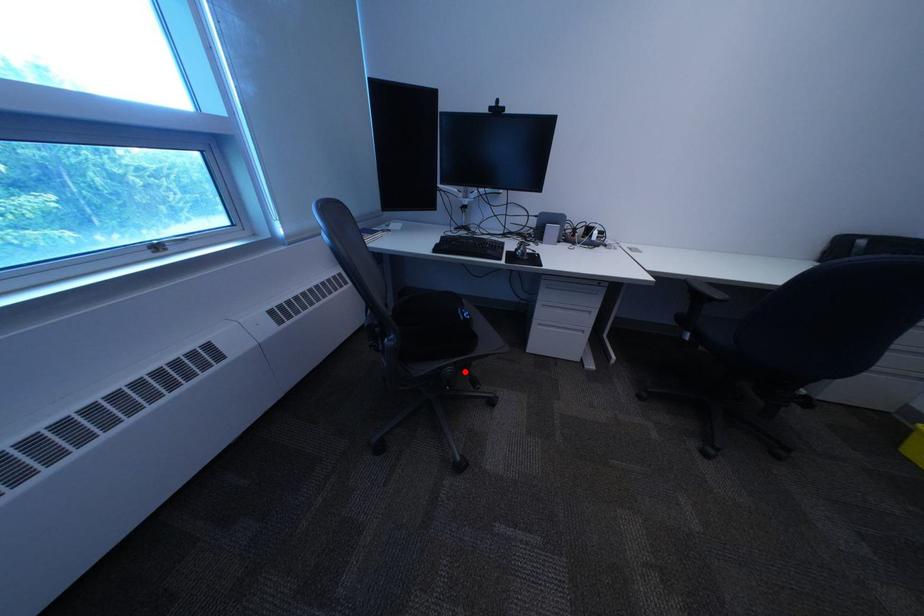
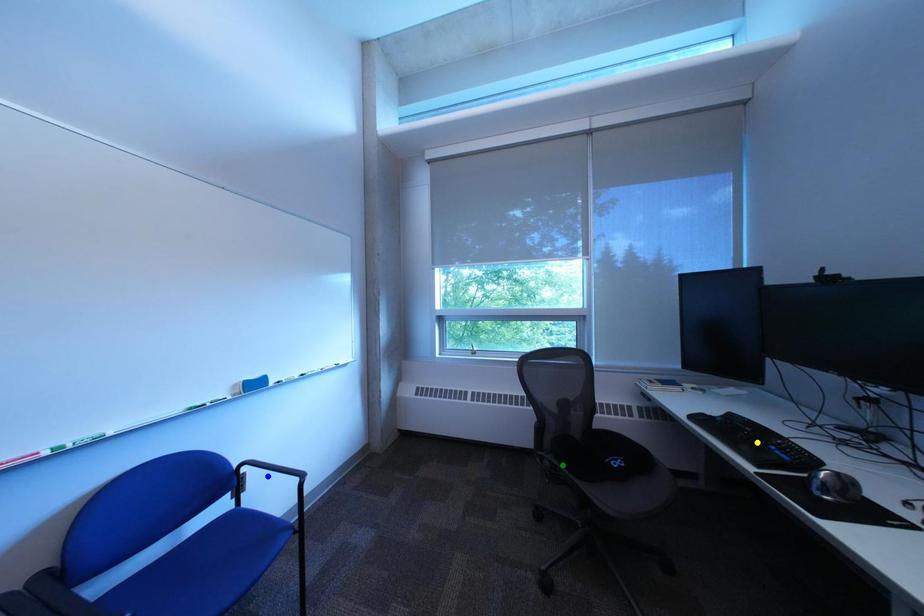
Question: I am providing you with two images of the same scene from different viewpoints. A red point is marked on the first image. You are given multiple points on the second image. Which point in image 2 is actually the same real-world point as the red point in image 1?

Choices:
 (A) blue point
 (B) green point
 (C) yellow point

Answer: (B)